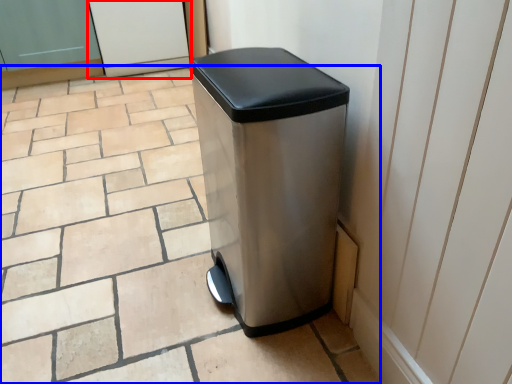
Question: Which of the following is the farthest to the observer, screen door (highlighted by a red box) or tile (highlighted by a blue box)?

Choices:
 (A) screen door
 (B) tile

Answer: (A)